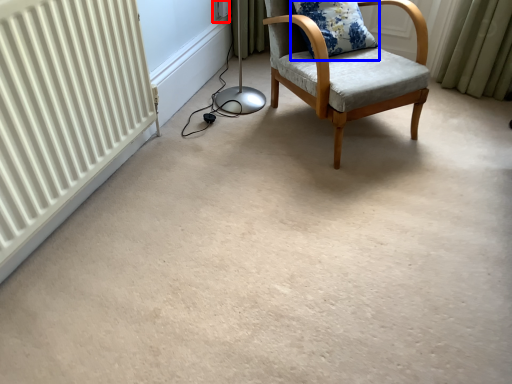
Question: Which of the following is the farthest to the observer, electric outlet (highlighted by a red box) or pillow (highlighted by a blue box)?

Choices:
 (A) electric outlet
 (B) pillow

Answer: (A)